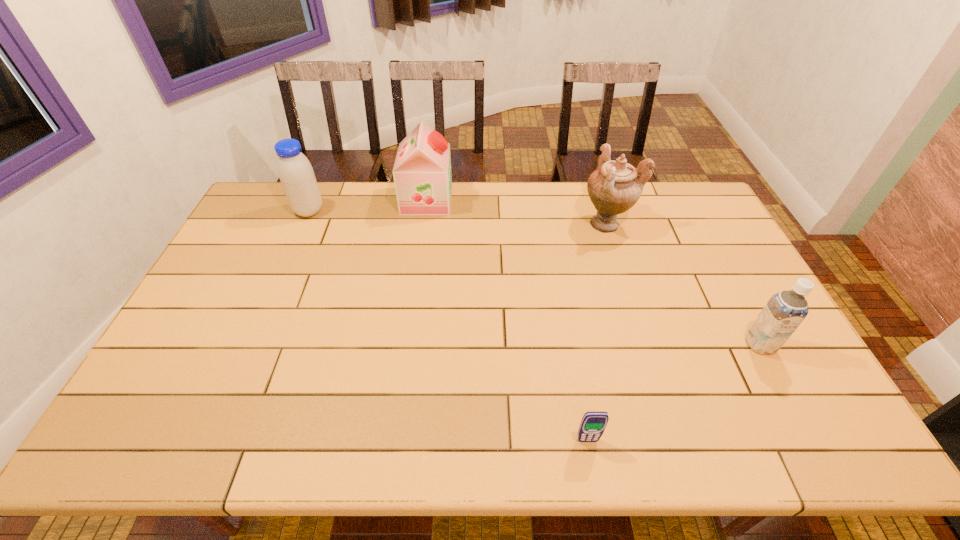
Locate an element on the screen. free spot located on the label of the nearest soya milk is located at coordinates (803, 424).

Where is `urn that is at the far edge`? urn that is at the far edge is located at coordinates (614, 187).

The image size is (960, 540). I want to click on object located in the near edge section of the desktop, so click(593, 424).

The width and height of the screenshot is (960, 540). What are the coordinates of `object located in the left edge section of the desktop` in the screenshot? It's located at (296, 174).

At what (x,y) coordinates should I click in order to perform the action: click on object that is at the right edge. Please return your answer as a coordinate pair (x, y). The height and width of the screenshot is (540, 960). Looking at the image, I should click on (784, 312).

What are the coordinates of `object present at the far left corner` in the screenshot? It's located at (296, 174).

Where is `vacant area at the far edge`? vacant area at the far edge is located at coordinates (581, 215).

Where is `vacant point at the near edge`? The width and height of the screenshot is (960, 540). vacant point at the near edge is located at coordinates (695, 423).

Locate an element on the screen. vacant space at the left edge of the desktop is located at coordinates (284, 223).

Where is `free region at the right edge of the desktop`? free region at the right edge of the desktop is located at coordinates (684, 238).